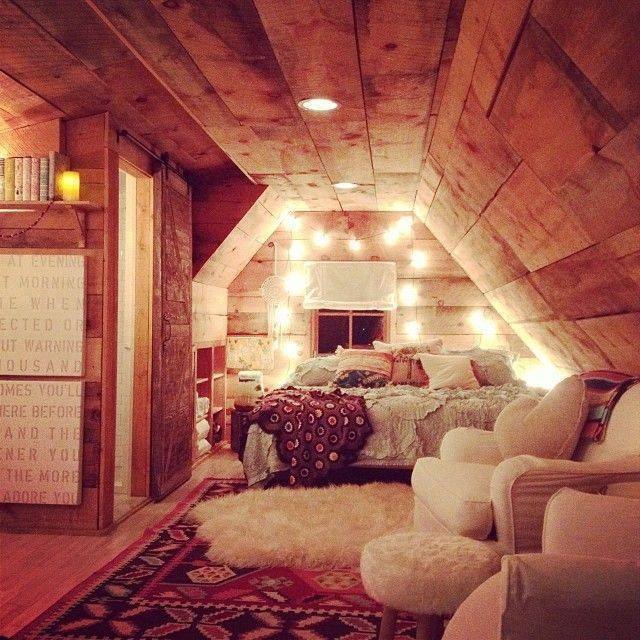
Where is `ceiling light`? The height and width of the screenshot is (640, 640). ceiling light is located at coordinates (323, 107), (340, 186).